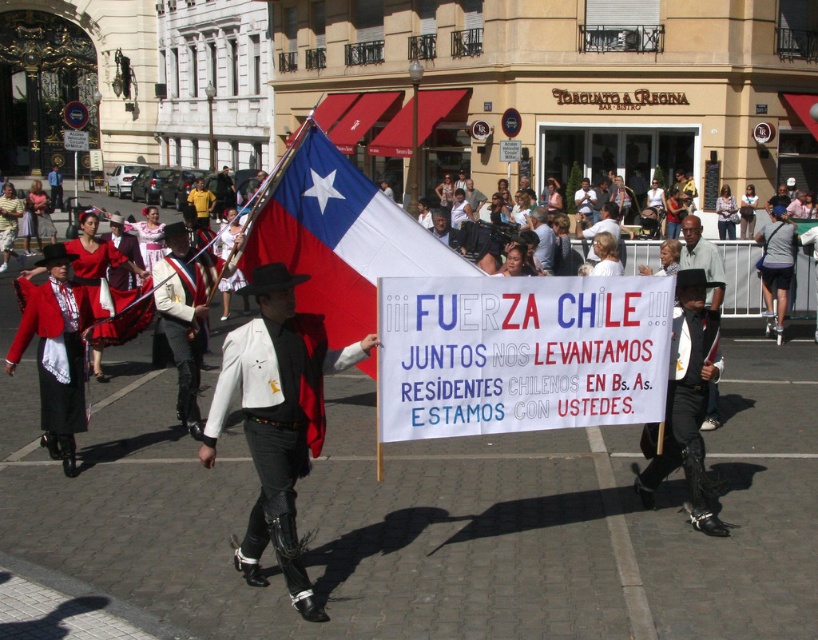
Question: Does white paper banner at center come in front of white matte vest at center?

Choices:
 (A) no
 (B) yes

Answer: (A)

Question: Which is nearer to the dark gray fabric pants at center?

Choices:
 (A) white paper banner at center
 (B) white leather boots at lower right
 (C) matte fabric flag at center

Answer: (B)

Question: Does dark gray fabric pants at center appear under dark gray fabric shirt at center?

Choices:
 (A) yes
 (B) no

Answer: (A)

Question: Is matte fabric flag at center thinner than dark gray fabric shirt at center?

Choices:
 (A) no
 (B) yes

Answer: (A)

Question: Which of the following is the farthest from the observer?

Choices:
 (A) white matte vest at center
 (B) red satin dress at center
 (C) white leather boots at lower right
 (D) matte fabric flag at center

Answer: (B)

Question: Which object appears farthest from the camera in this image?

Choices:
 (A) dark gray fabric pants at center
 (B) matte red jacket at left
 (C) matte fabric flag at center
 (D) white paper banner at center

Answer: (A)